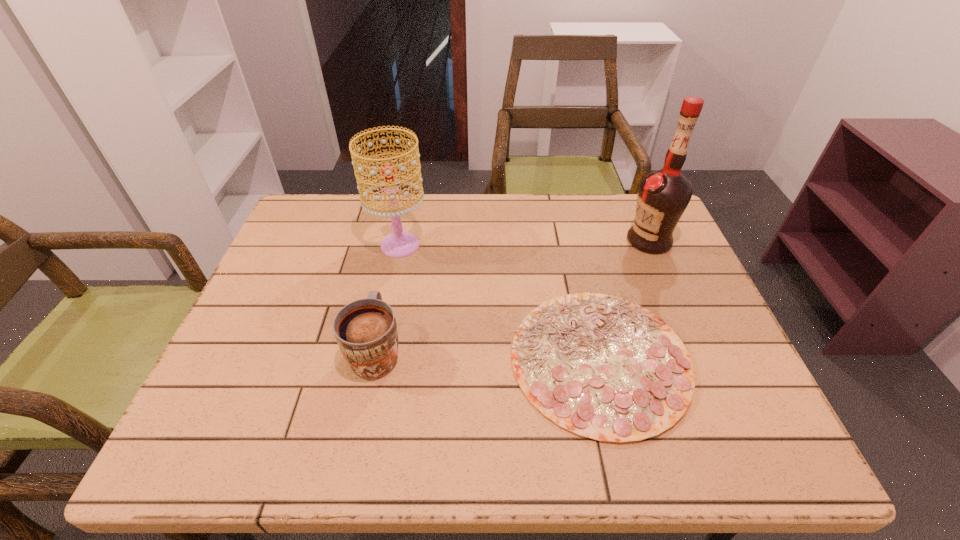
Find the location of a particular element. unoccupied area between the liquor and the third shortest object is located at coordinates (524, 242).

This screenshot has height=540, width=960. Identify the location of empty space that is in between the lampshade and the third tallest object. (389, 298).

What are the coordinates of `object that ranks as the closest to the pizza` in the screenshot? It's located at (663, 195).

Point out which object is positioned as the second nearest to the third tallest object. Please provide its 2D coordinates. Your answer should be formatted as a tuple, i.e. [(x, y)], where the tuple contains the x and y coordinates of a point satisfying the conditions above.

[(605, 368)]

Where is `blank area in the image that satisfies the following two spatial constraints: 1. on the front and back of the liquor; 2. on the front side of the second tallest object`? blank area in the image that satisfies the following two spatial constraints: 1. on the front and back of the liquor; 2. on the front side of the second tallest object is located at coordinates (651, 245).

Image resolution: width=960 pixels, height=540 pixels. Identify the location of vacant space that satisfies the following two spatial constraints: 1. on the side of the third shortest object with the handle; 2. on the right side of the second shortest object. (398, 245).